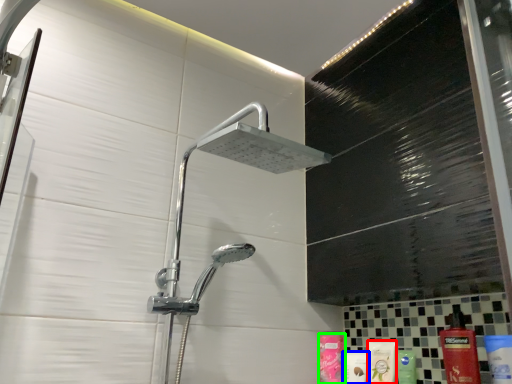
Question: Which object is the farthest from mouthwash (highlighted by a red box)? Choose among these: toiletry (highlighted by a blue box) or toiletry (highlighted by a green box).

Choices:
 (A) toiletry
 (B) toiletry

Answer: (B)